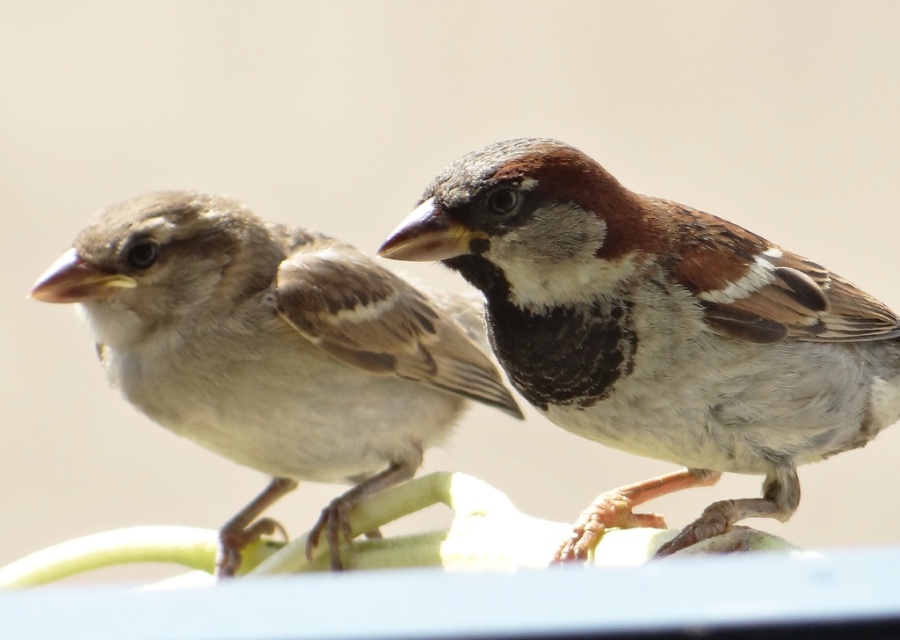
You are a birdwatcher observing two birds in the image. You notice the brown speckled feathers at center and the brown feathered sparrow at left. Which of these has a shorter height?

The brown speckled feathers at center is shorter than the brown feathered sparrow at left.

You are a birdwatcher observing two sparrows on a branch. You notice the brown speckled feathers at center and the brown feathered sparrow at left. Which one is positioned lower on the branch?

The brown speckled feathers at center is positioned lower than the brown feathered sparrow at left.

You are a birdwatcher observing two sparrows on a branch. You notice a point marked at coordinates [657,330]. Which part of the birds does this point indicate?

The point marked at coordinates [657,330] indicates the brown speckled feathers at center.